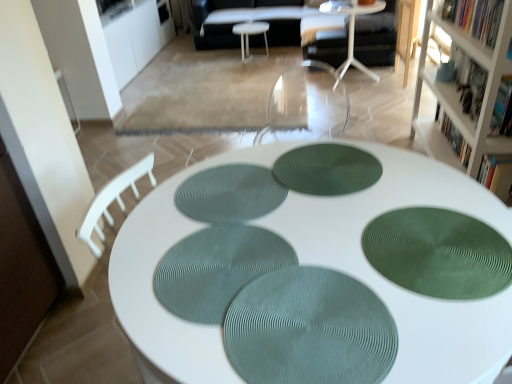
The image size is (512, 384). Find the location of `free space above green textured placemat at center (from a real-world perspective)`. free space above green textured placemat at center (from a real-world perspective) is located at coordinates (308, 325).